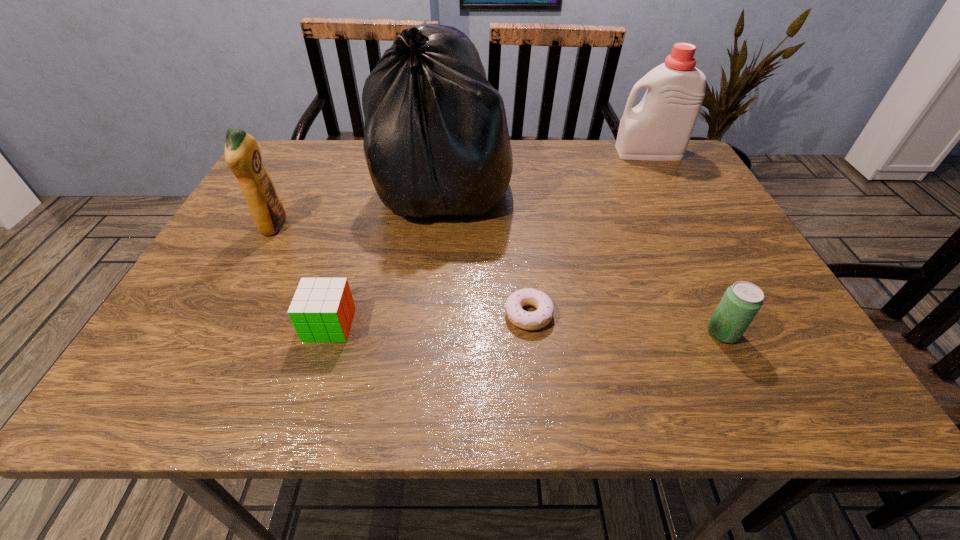
Find the location of `free space located 0.130m on the handle side of the right detergent`. free space located 0.130m on the handle side of the right detergent is located at coordinates (570, 152).

You are a GUI agent. You are given a task and a screenshot of the screen. Output one action in this format:
    pyautogui.click(x=<x>, y=<y>)
    Task: Click on the free location located 0.050m on the label of the shorter detergent
    
    Given the screenshot: What is the action you would take?
    pyautogui.click(x=306, y=226)

Locate an element on the screen. vacant space located 0.230m on the back of the fourth tallest object is located at coordinates pyautogui.click(x=678, y=241).

This screenshot has height=540, width=960. Identify the location of vacant space situated 0.190m on the back of the cube. (354, 244).

The width and height of the screenshot is (960, 540). Find the location of `free space located 0.180m on the back of the doughnut`. free space located 0.180m on the back of the doughnut is located at coordinates (521, 238).

You are a GUI agent. You are given a task and a screenshot of the screen. Output one action in this format:
    pyautogui.click(x=<x>, y=<y>)
    Task: Click on the plastic bag at the far edge
    This screenshot has width=960, height=540.
    Given the screenshot: What is the action you would take?
    pyautogui.click(x=436, y=142)

Identify the location of detergent that is positioned at the far edge. This screenshot has height=540, width=960. point(659,128).

The image size is (960, 540). What are the coordinates of `object present at the left edge` in the screenshot? It's located at (242, 154).

I want to click on detergent located at the right edge, so click(x=659, y=128).

Where is `soda that is at the right edge`? soda that is at the right edge is located at coordinates (741, 302).